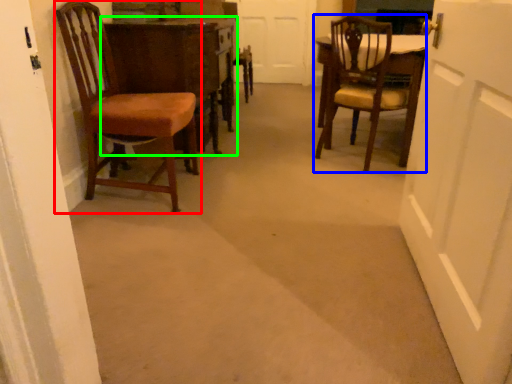
Question: Based on their relative distances, which object is farther from chair (highlighted by a red box)? Choose from chair (highlighted by a blue box) and table (highlighted by a green box).

Choices:
 (A) chair
 (B) table

Answer: (A)